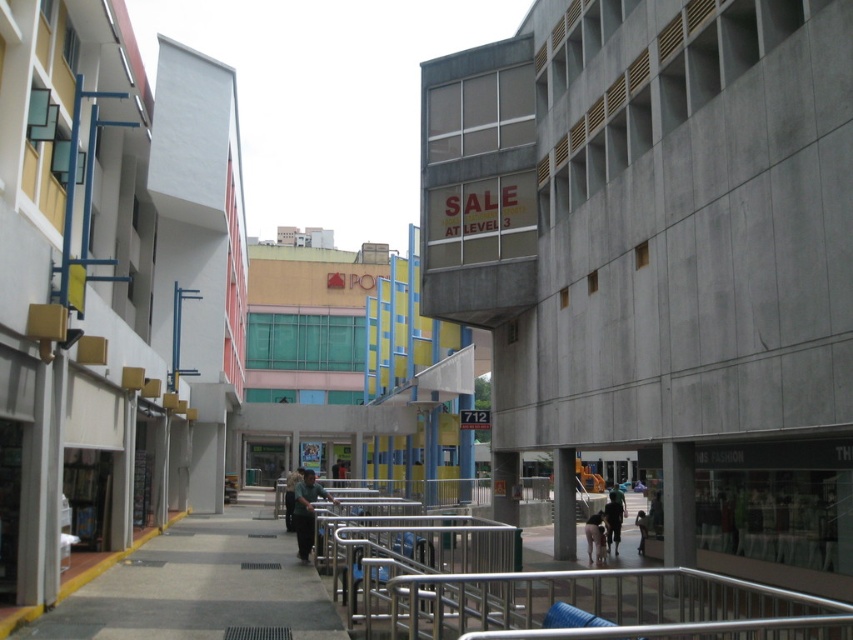
Question: Which of the following is the farthest from the observer?

Choices:
 (A) (277, 566)
 (B) (601, 538)
 (C) (637, 545)

Answer: (C)

Question: Which point is farther from the camera taking this photo?

Choices:
 (A) (601, 547)
 (B) (451, 605)
 (C) (302, 515)
 (D) (641, 518)

Answer: (D)

Question: Is silver metallic railing at center closer to camera compared to dark brown leather jacket at lower center?

Choices:
 (A) yes
 (B) no

Answer: (A)

Question: Does silver metallic railing at center appear under dark gray fabric jacket at center?

Choices:
 (A) no
 (B) yes

Answer: (A)

Question: Which of the following is the farthest from the observer?

Choices:
 (A) light brown leather jacket at lower right
 (B) dark gray fabric jacket at center

Answer: (A)

Question: Can you confirm if silver metallic railing at center is thinner than dark gray fabric jacket at center?

Choices:
 (A) yes
 (B) no

Answer: (B)